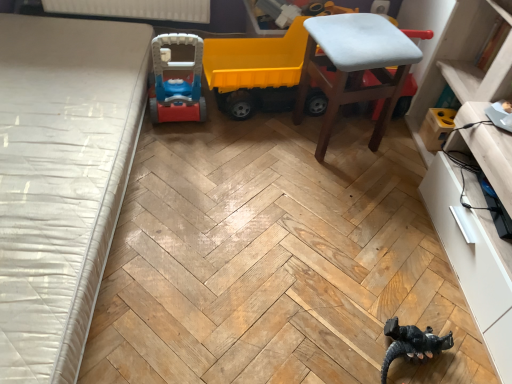
The image size is (512, 384). In order to click on vacant area that is situated to the right of light blue fabric stool at upper right in this screenshot , I will do `click(396, 153)`.